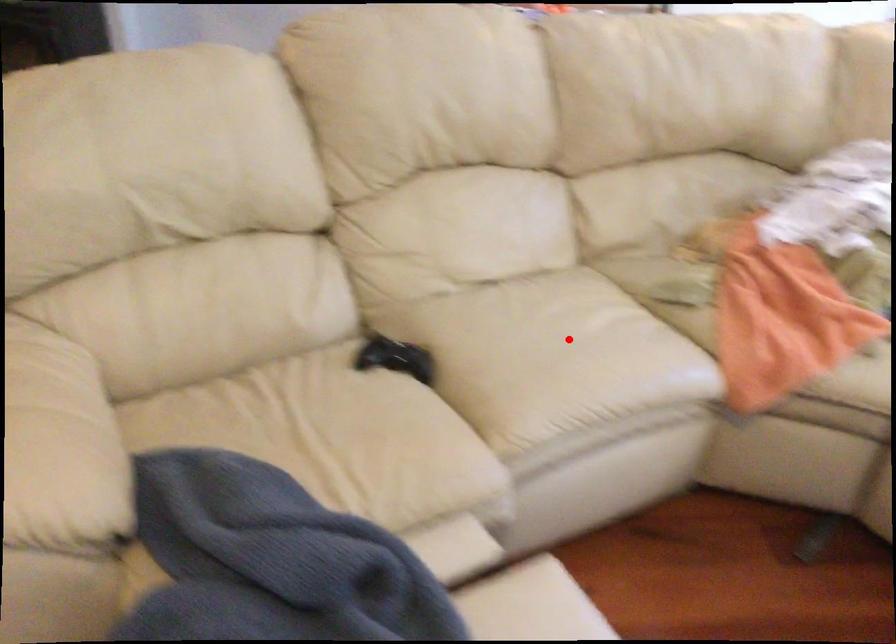
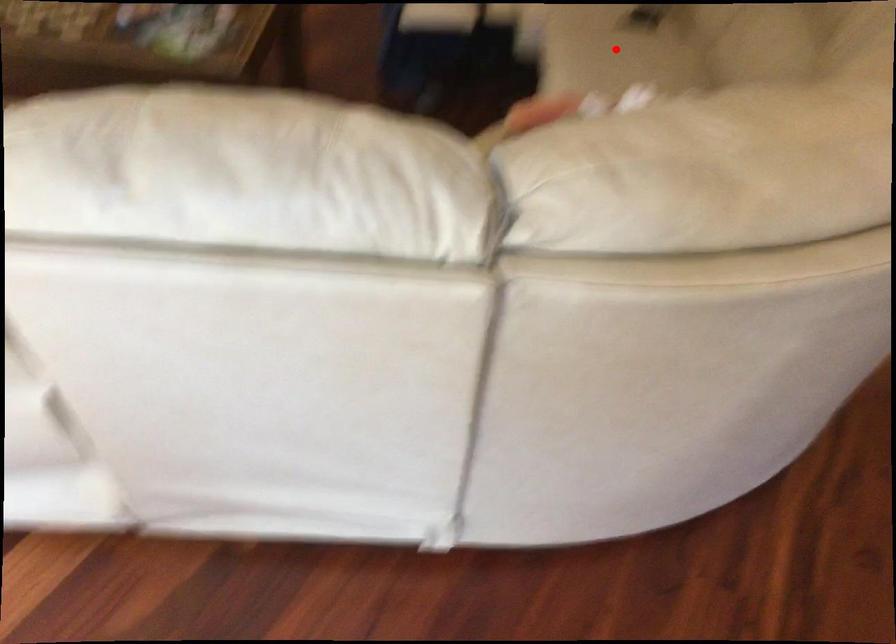
I am providing you with two images of the same scene from different viewpoints. A red point is marked on the first image and another point is marked on the second image. Is the red point in image1 aligned with the point shown in image2?

Yes